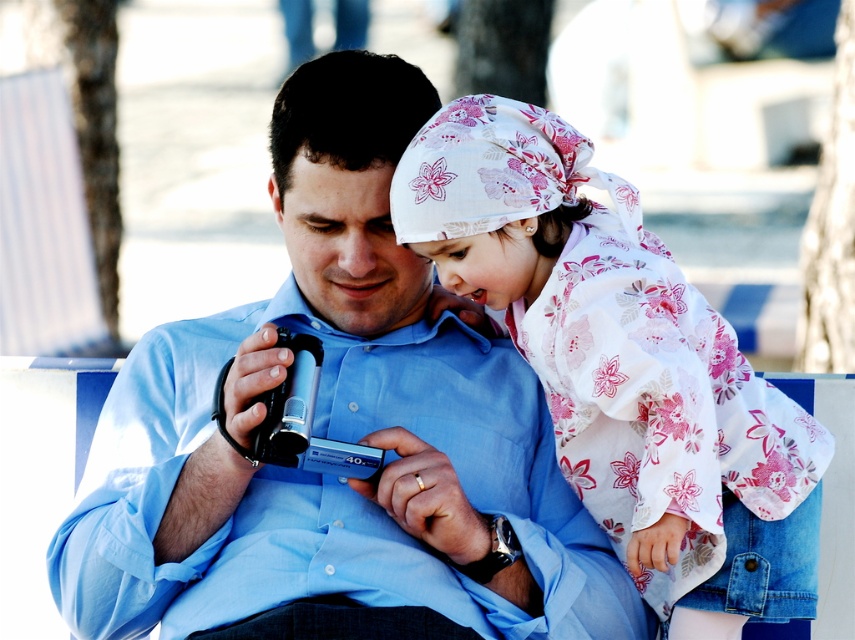
Question: In this image, where is blue cotton shirt at center located relative to floral-patterned fabric at upper right?

Choices:
 (A) right
 (B) left

Answer: (B)

Question: Which of the following is the farthest from the observer?

Choices:
 (A) pos(640,300)
 (B) pos(388,179)

Answer: (B)

Question: Does blue cotton shirt at center have a smaller size compared to floral-patterned fabric at upper right?

Choices:
 (A) no
 (B) yes

Answer: (A)

Question: Does blue cotton shirt at center appear on the left side of floral-patterned fabric at upper right?

Choices:
 (A) yes
 (B) no

Answer: (A)

Question: Which point appears closest to the camera in this image?

Choices:
 (A) (499, 509)
 (B) (597, 394)

Answer: (B)